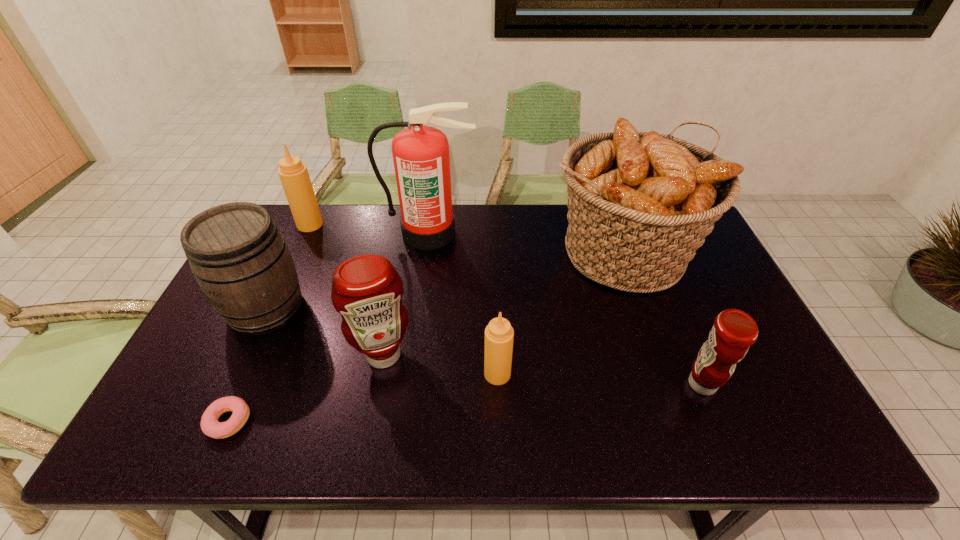
Find the location of a particular element. Image resolution: width=960 pixels, height=540 pixels. free space between the basket and the farther tan condiment is located at coordinates (466, 238).

Where is `free area in between the fire extinguisher and the shortest object`? free area in between the fire extinguisher and the shortest object is located at coordinates (329, 327).

Identify the location of free space between the second condiment from right to left and the rightmost condiment. (600, 379).

I want to click on vacant area that lies between the right tan condiment and the pink doughnut, so click(x=363, y=398).

You are a GUI agent. You are given a task and a screenshot of the screen. Output one action in this format:
    pyautogui.click(x=<x>, y=<y>)
    Task: Click on the vacant point located between the right red condiment and the nearer tan condiment
    This screenshot has width=960, height=540.
    Given the screenshot: What is the action you would take?
    pyautogui.click(x=600, y=379)

At what (x,y) coordinates should I click in order to perform the action: click on free area in between the rightmost condiment and the second condiment from left to right. Please return your answer as a coordinate pair (x, y). The width and height of the screenshot is (960, 540). Looking at the image, I should click on (542, 369).

Identify which object is the fourth closest to the nearer tan condiment. Please provide its 2D coordinates. Your answer should be formatted as a tuple, i.e. [(x, y)], where the tuple contains the x and y coordinates of a point satisfying the conditions above.

[(421, 158)]

Where is `object identified as the seventh closest to the farthest condiment`? object identified as the seventh closest to the farthest condiment is located at coordinates (734, 331).

This screenshot has width=960, height=540. What are the coordinates of `the closest condiment relative to the bigger tan condiment` in the screenshot? It's located at (366, 290).

Where is `the third closest condiment to the right tan condiment`? Image resolution: width=960 pixels, height=540 pixels. the third closest condiment to the right tan condiment is located at coordinates (294, 176).